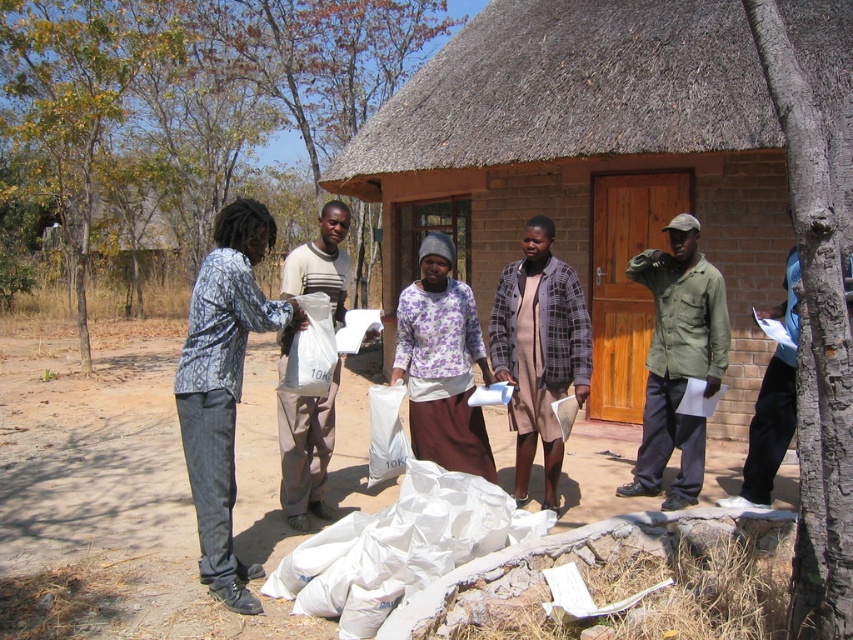
Which is below, thatched roof hut at center or matte green shirt at center?

matte green shirt at center

Between point (595, 316) and point (648, 483), which one is positioned behind?

Positioned behind is point (595, 316).

This screenshot has width=853, height=640. Describe the element at coordinates (590, 163) in the screenshot. I see `thatched roof hut at center` at that location.

This screenshot has width=853, height=640. I want to click on thatched roof hut at center, so click(590, 163).

Between white fabric sack at center and patterned fabric shirt at center, which one has less height?

white fabric sack at center

Can you confirm if white fabric sack at center is positioned above patterned fabric shirt at center?

No.

Describe the element at coordinates (399, 547) in the screenshot. The height and width of the screenshot is (640, 853). I see `white fabric sack at center` at that location.

The height and width of the screenshot is (640, 853). I want to click on white fabric sack at center, so click(399, 547).

Does point (190, 317) come behind point (383, 436)?

No.

Describe the element at coordinates (224, 385) in the screenshot. I see `patterned fabric shirt at center` at that location.

Is point (218, 506) farther from camera compared to point (409, 449)?

That is False.

Where is `patterned fabric shirt at center`? This screenshot has width=853, height=640. patterned fabric shirt at center is located at coordinates (224, 385).